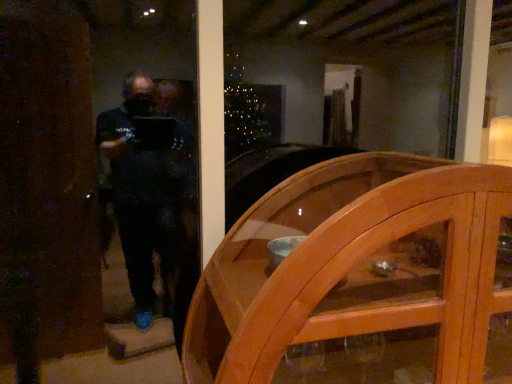
Describe the element at coordinates (357, 272) in the screenshot. The image size is (512, 384). I see `wooden cabinet at right` at that location.

You are a GUI agent. You are given a task and a screenshot of the screen. Output one action in this format:
    pyautogui.click(x=<x>, y=<y>)
    Task: Click on the wooden cabinet at right
    This screenshot has height=384, width=512.
    Given the screenshot: What is the action you would take?
    pyautogui.click(x=357, y=272)

Where is `wooden cabinet at right`? wooden cabinet at right is located at coordinates (357, 272).